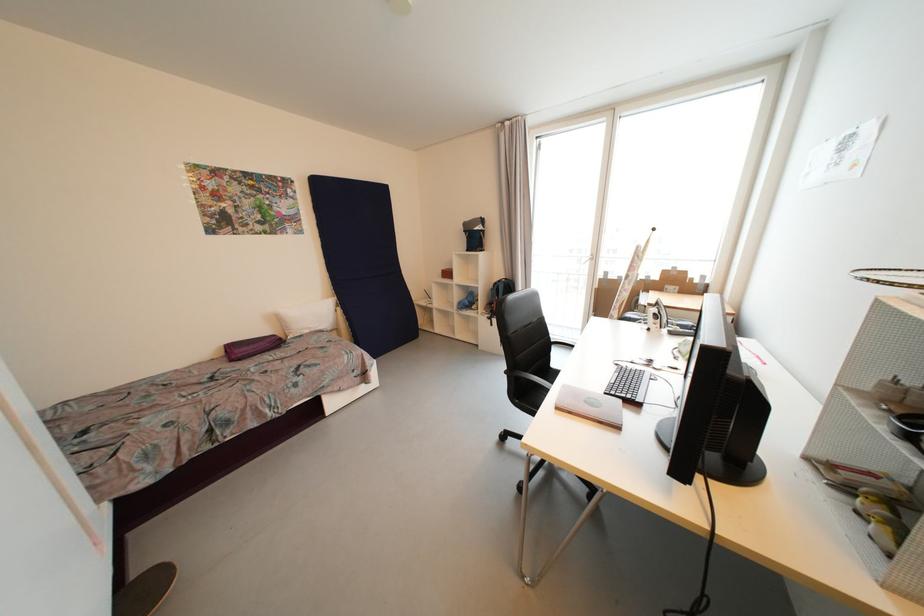
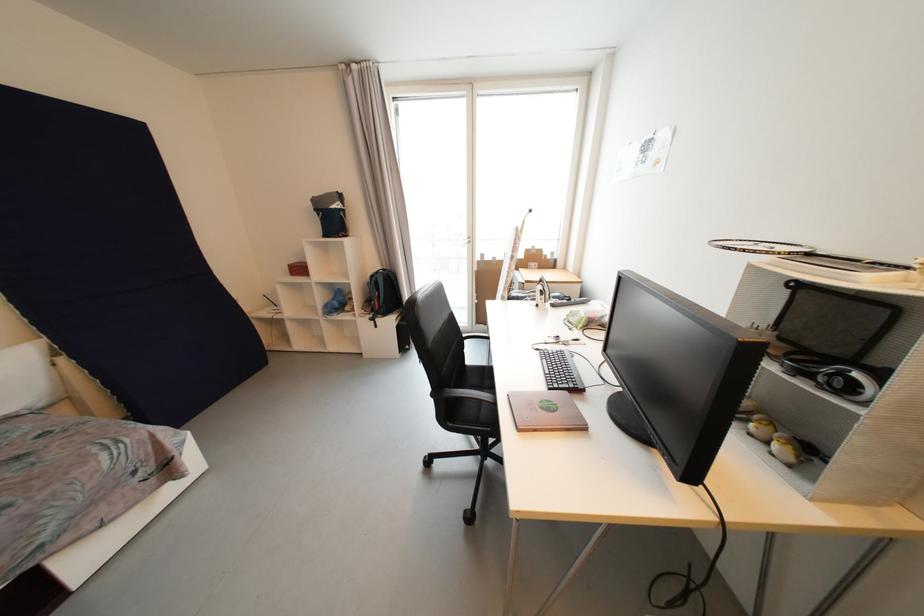
Question: How did the camera likely rotate?

Choices:
 (A) Left
 (B) Right
 (C) Up
 (D) Down

Answer: (B)